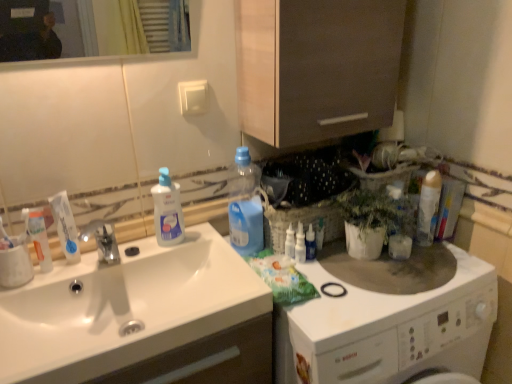
This screenshot has width=512, height=384. What do you see at coordinates (300, 245) in the screenshot?
I see `translucent plastic spray bottle at upper right, marked as the 3th toiletry in a back-to-front arrangement` at bounding box center [300, 245].

What is the approximate height of white matte toothpaste tube at left, which is the 1th toiletry in left-to-right order?

white matte toothpaste tube at left, which is the 1th toiletry in left-to-right order, is 6.73 inches in height.

This screenshot has height=384, width=512. What do you see at coordinates (290, 242) in the screenshot?
I see `translucent plastic bottles at center, the 2th toiletry in the back-to-front sequence` at bounding box center [290, 242].

Find the location of a particular element. The height and width of the screenshot is (384, 512). brown wood cabinet at upper center is located at coordinates (316, 67).

The width and height of the screenshot is (512, 384). Find the location of `white glossy washing machine at right`. white glossy washing machine at right is located at coordinates coord(387,317).

In order to face translucent plastic bottle at upper center, which is the 2th cleaning product from right to left, should I rotate leftwards or rightwards?

To face it directly, rotate left by 0.901 degrees.

The image size is (512, 384). What do you see at coordinates (65, 226) in the screenshot?
I see `white glossy toothpaste at left` at bounding box center [65, 226].

Where is `translucent plastic spray bottle at upper right, positioned as the third toiletry in left-to-right order`? The width and height of the screenshot is (512, 384). translucent plastic spray bottle at upper right, positioned as the third toiletry in left-to-right order is located at coordinates (300, 245).

Who is smaller, translucent plastic bottle at upper center, which is the second cleaning product in left-to-right order, or transparent plastic bottle at upper right?

transparent plastic bottle at upper right.

How distant is translucent plastic bottle at upper center, which is the second cleaning product in left-to-right order, from transparent plastic bottle at upper right?

7.93 inches.

Considering the positions of points (234, 232) and (308, 239), is point (234, 232) closer to camera compared to point (308, 239)?

No, (234, 232) is further to viewer.

Based on the photo, is translucent plastic bottle at upper center, which is the 2th cleaning product from right to left, turned away from transparent plastic bottle at upper right?

No, translucent plastic bottle at upper center, which is the 2th cleaning product from right to left,'s orientation is not away from transparent plastic bottle at upper right.

You are a GUI agent. You are given a task and a screenshot of the screen. Output one action in this format:
    pyautogui.click(x=<x>, y=<y>)
    Task: Click on the washing machine to the right of brown wood cabinet at upper center
    
    Given the screenshot: What is the action you would take?
    pyautogui.click(x=387, y=317)

Is white glossy washing machine at right taller than brown wood cabinet at upper center?

Indeed, white glossy washing machine at right has a greater height compared to brown wood cabinet at upper center.

Considering the relative positions of white glossy washing machine at right and brown wood cabinet at upper center in the image provided, is white glossy washing machine at right to the left of brown wood cabinet at upper center from the viewer's perspective?

In fact, white glossy washing machine at right is to the right of brown wood cabinet at upper center.

Is white glossy washing machine at right inside or outside of brown wood cabinet at upper center?

The correct answer is: outside.

Is translucent plastic bottles at center, the 3th toiletry when ordered from front to back, oriented away from translucent plastic bottle at upper center, which is the second cleaning product in left-to-right order?

No, translucent plastic bottles at center, the 3th toiletry when ordered from front to back,'s orientation is not away from translucent plastic bottle at upper center, which is the second cleaning product in left-to-right order.

Based on the photo, how many degrees apart are the facing directions of translucent plastic bottles at center, the 3th toiletry when ordered from front to back, and translucent plastic bottle at upper center, which is the second cleaning product in left-to-right order?

The angle between the facing direction of translucent plastic bottles at center, the 3th toiletry when ordered from front to back, and the facing direction of translucent plastic bottle at upper center, which is the second cleaning product in left-to-right order, is 0.00507 degrees.

From the image's perspective, which object appears higher, translucent plastic bottles at center, the 2th toiletry in the back-to-front sequence, or translucent plastic bottle at upper center, which is the 2th cleaning product from right to left?

translucent plastic bottle at upper center, which is the 2th cleaning product from right to left, is shown above in the image.

Starting from the translucent plastic bottles at center, the 3th toiletry when ordered from front to back, which cleaning product is the 1st one in front? Please provide its 2D coordinates.

[(245, 205)]

Is translucent plastic bottles at center, placed as the third toiletry when sorted from right to left, far away from translucent plastic bottles at upper right, acting as the 1th toiletry starting from the back?

translucent plastic bottles at center, placed as the third toiletry when sorted from right to left, is near translucent plastic bottles at upper right, acting as the 1th toiletry starting from the back, not far away.

Based on the photo, can you confirm if translucent plastic bottles at center, the 2th toiletry when ordered from left to right, is positioned to the left of translucent plastic bottles at upper right, positioned as the fourth toiletry in front-to-back order?

Yes, translucent plastic bottles at center, the 2th toiletry when ordered from left to right, is to the left of translucent plastic bottles at upper right, positioned as the fourth toiletry in front-to-back order.

Which object is more forward, translucent plastic bottles at center, the 2th toiletry in the back-to-front sequence, or translucent plastic bottles at upper right, positioned as the fourth toiletry in front-to-back order?

translucent plastic bottles at center, the 2th toiletry in the back-to-front sequence, is in front.

Looking at their sizes, would you say translucent plastic bottles at center, placed as the third toiletry when sorted from right to left, is wider or thinner than translucent plastic bottles at upper right, positioned as the fourth toiletry in front-to-back order?

In the image, translucent plastic bottles at center, placed as the third toiletry when sorted from right to left, appears to be more narrow than translucent plastic bottles at upper right, positioned as the fourth toiletry in front-to-back order.

Is white matte toothpaste tube at left, which is the 1th toiletry in left-to-right order, oriented away from white matte aerosol can at upper right, marked as the first cleaning product in a right-to-left arrangement?

white matte toothpaste tube at left, which is the 1th toiletry in left-to-right order, does not have its back to white matte aerosol can at upper right, marked as the first cleaning product in a right-to-left arrangement.

Which object is thinner, white matte toothpaste tube at left, which is counted as the fourth toiletry, starting from the back, or white matte aerosol can at upper right, marked as the first cleaning product in a right-to-left arrangement?

Thinner between the two is white matte toothpaste tube at left, which is counted as the fourth toiletry, starting from the back.

From the image's perspective, would you say white matte toothpaste tube at left, the fourth toiletry in the right-to-left sequence, is shown under white matte aerosol can at upper right, arranged as the 3th cleaning product when viewed from the left?

Yes, from the image's perspective, white matte toothpaste tube at left, the fourth toiletry in the right-to-left sequence, is below white matte aerosol can at upper right, arranged as the 3th cleaning product when viewed from the left.

Which is more to the right, white matte toothpaste tube at left, which is the 1th toiletry in left-to-right order, or white matte aerosol can at upper right, marked as the first cleaning product in a right-to-left arrangement?

Positioned to the right is white matte aerosol can at upper right, marked as the first cleaning product in a right-to-left arrangement.

From the picture: Between brown wood cabinet at upper center and translucent plastic bottles at center, placed as the third toiletry when sorted from right to left, which one is positioned in front?

brown wood cabinet at upper center is in front.

In the scene shown: Measure the distance between brown wood cabinet at upper center and translucent plastic bottles at center, the 3th toiletry when ordered from front to back.

brown wood cabinet at upper center and translucent plastic bottles at center, the 3th toiletry when ordered from front to back, are 17.54 inches apart.

Based on the photo, considering the relative sizes of brown wood cabinet at upper center and translucent plastic bottles at center, the 3th toiletry when ordered from front to back, in the image provided, is brown wood cabinet at upper center bigger than translucent plastic bottles at center, the 3th toiletry when ordered from front to back,?

Indeed, brown wood cabinet at upper center has a larger size compared to translucent plastic bottles at center, the 3th toiletry when ordered from front to back.

Consider the image. Would you say brown wood cabinet at upper center is inside or outside translucent plastic bottles at center, the 2th toiletry in the back-to-front sequence?

brown wood cabinet at upper center is outside translucent plastic bottles at center, the 2th toiletry in the back-to-front sequence.

In terms of width, does white glossy sink at left look wider or thinner when compared to translucent plastic spray bottle at upper right, marked as the 3th toiletry in a back-to-front arrangement?

In the image, white glossy sink at left appears to be wider than translucent plastic spray bottle at upper right, marked as the 3th toiletry in a back-to-front arrangement.

Does white glossy sink at left have a greater height compared to translucent plastic spray bottle at upper right, which is counted as the 2th toiletry, starting from the right?

Indeed, white glossy sink at left has a greater height compared to translucent plastic spray bottle at upper right, which is counted as the 2th toiletry, starting from the right.

The width and height of the screenshot is (512, 384). In order to click on sink located below the translucent plastic spray bottle at upper right, which is counted as the 2th toiletry, starting from the right (from the image's perspective) in this screenshot , I will do 141,318.

Between white glossy sink at left and translucent plastic spray bottle at upper right, arranged as the 2th toiletry when viewed from the front, which one appears on the right side from the viewer's perspective?

translucent plastic spray bottle at upper right, arranged as the 2th toiletry when viewed from the front.

Where is `the 2nd cleaning product located above the transparent plastic bottle at upper right (from a real-world perspective)`? the 2nd cleaning product located above the transparent plastic bottle at upper right (from a real-world perspective) is located at coordinates (245, 205).

Where is `cabinetry on the left of white glossy washing machine at right`? The image size is (512, 384). cabinetry on the left of white glossy washing machine at right is located at coordinates coord(316,67).

From the image, which object appears to be nearer to white glossy washing machine at right, translucent plastic bottles at upper right, positioned as the fourth toiletry in front-to-back order, or white glossy sink at left?

Based on the image, translucent plastic bottles at upper right, positioned as the fourth toiletry in front-to-back order, appears to be nearer to white glossy washing machine at right.

Based on the photo, when comparing their distances from translucent plastic bottles at upper right, acting as the 1th toiletry starting from the back, does translucent plastic bottles at center, the 2th toiletry when ordered from left to right, or clear plastic bottle at sink, which ranks as the third cleaning product in right-to-left order, seem closer?

translucent plastic bottles at center, the 2th toiletry when ordered from left to right, is positioned closer to the anchor translucent plastic bottles at upper right, acting as the 1th toiletry starting from the back.

Looking at this image, looking at the image, which one is located closer to white glossy toothpaste at left, white glossy sink at left or transparent plastic bottle at upper right?

white glossy sink at left is closer to white glossy toothpaste at left.

From the image, which object appears to be farther from translucent plastic bottles at center, the 2th toiletry in the back-to-front sequence, white matte aerosol can at upper right, marked as the first cleaning product in a right-to-left arrangement, or brown wood cabinet at upper center?

brown wood cabinet at upper center.

From the image, which object appears to be farther from white glossy sink at left, clear plastic bottle at sink, which appears as the first cleaning product when viewed from the left, or white glossy toothpaste at left?

Based on the image, white glossy toothpaste at left appears to be further to white glossy sink at left.

Considering their positions, is translucent plastic bottles at upper right, positioned as the fourth toiletry in front-to-back order, positioned further to white glossy washing machine at right than white matte toothpaste tube at left, the fourth toiletry in the right-to-left sequence?

Among the two, white matte toothpaste tube at left, the fourth toiletry in the right-to-left sequence, is located further to white glossy washing machine at right.

Looking at the image, which one is located further to translucent plastic spray bottle at upper right, which is counted as the 2th toiletry, starting from the right, translucent plastic bottles at center, the 2th toiletry in the back-to-front sequence, or white glossy toothpaste at left?

white glossy toothpaste at left lies further to translucent plastic spray bottle at upper right, which is counted as the 2th toiletry, starting from the right, than the other object.

Which object lies further to the anchor point translucent plastic spray bottle at upper right, arranged as the 2th toiletry when viewed from the front, white matte aerosol can at upper right, arranged as the 3th cleaning product when viewed from the left, or clear plastic bottle at sink, which ranks as the third cleaning product in right-to-left order?

Among the two, white matte aerosol can at upper right, arranged as the 3th cleaning product when viewed from the left, is located further to translucent plastic spray bottle at upper right, arranged as the 2th toiletry when viewed from the front.

Locate an element on the screen. bottle between clear plastic bottle at sink, which appears as the first cleaning product when viewed from the left, and white glossy sink at left vertically is located at coordinates (310, 243).

At what (x,y) coordinates should I click in order to perform the action: click on sink situated between white glossy toothpaste at left and translucent plastic bottles at upper right, which appears as the fourth toiletry when viewed from the left, from left to right. Please return your answer as a coordinate pair (x, y). Image resolution: width=512 pixels, height=384 pixels. Looking at the image, I should click on (141, 318).

At what (x,y) coordinates should I click in order to perform the action: click on washing machine between white glossy toothpaste at left and white matte aerosol can at upper right, arranged as the 3th cleaning product when viewed from the left, from left to right. Please return your answer as a coordinate pair (x, y). The height and width of the screenshot is (384, 512). Looking at the image, I should click on (387, 317).

What are the coordinates of `toiletry between clear plastic bottle at sink, which appears as the first cleaning product when viewed from the left, and translucent plastic spray bottle at upper right, positioned as the third toiletry in left-to-right order, from left to right` in the screenshot? It's located at (290, 242).